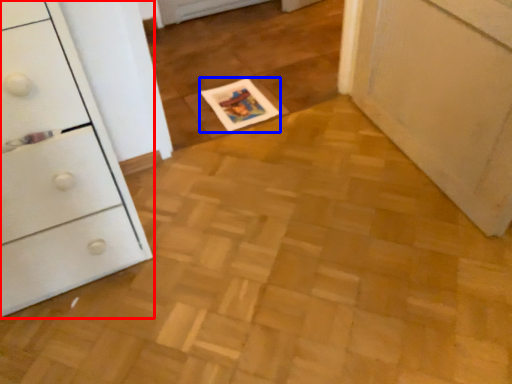
Question: Which point is further to the camera, chest of drawers (highlighted by a red box) or magazine (highlighted by a blue box)?

Choices:
 (A) chest of drawers
 (B) magazine

Answer: (B)